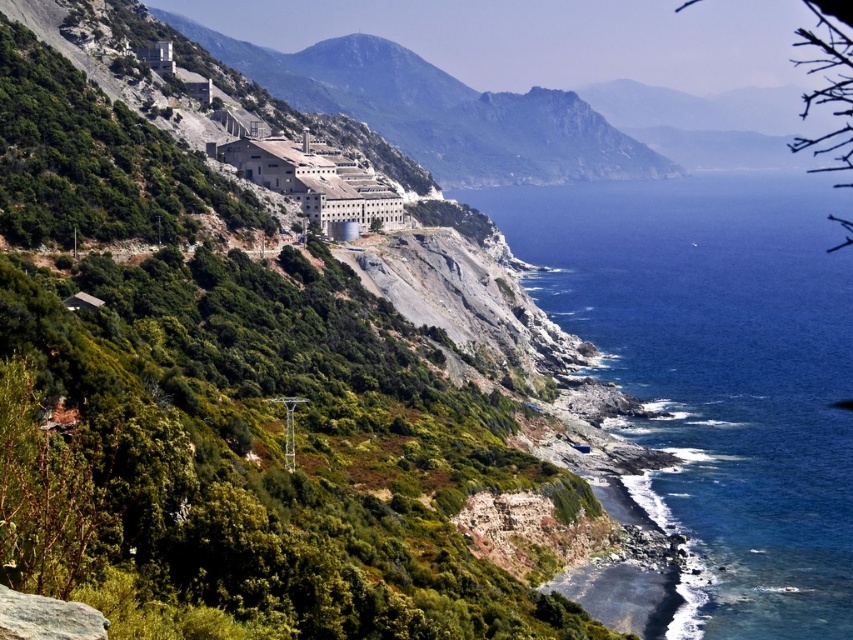
Question: Can you confirm if blue water at lower right is thinner than rugged stone mountain at upper center?

Choices:
 (A) no
 (B) yes

Answer: (B)

Question: Is blue water at lower right bigger than rugged stone mountain at upper center?

Choices:
 (A) yes
 (B) no

Answer: (A)

Question: Does blue water at lower right have a lesser width compared to rugged stone mountain at upper center?

Choices:
 (A) yes
 (B) no

Answer: (A)

Question: Which point is closer to the camera?

Choices:
 (A) rugged stone mountain at upper center
 (B) blue water at lower right

Answer: (B)